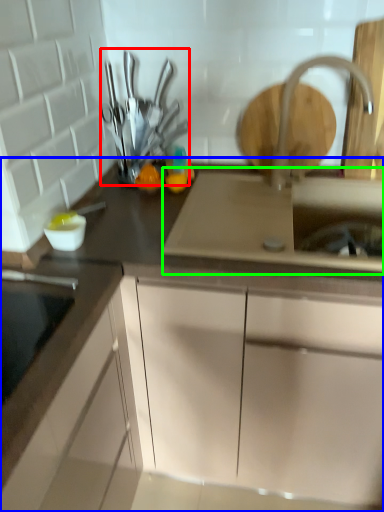
Question: Considering the real-world distances, which object is farthest from tableware (highlighted by a red box)? cabinetry (highlighted by a blue box) or sink (highlighted by a green box)?

Choices:
 (A) cabinetry
 (B) sink

Answer: (A)